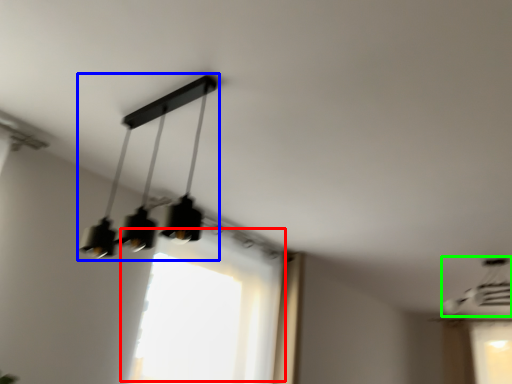
Question: Which object is positioned closest to window (highlighted by a red box)? Select from lamp (highlighted by a blue box) and lamp (highlighted by a green box).

Choices:
 (A) lamp
 (B) lamp

Answer: (A)